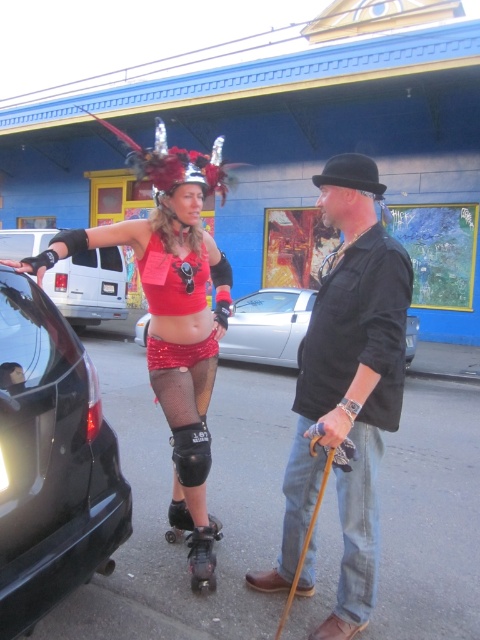
Question: Which object is positioned farthest from the black glossy car at left?

Choices:
 (A) shiny metallic shorts at center
 (B) black matte bowler hat at center
 (C) black matte car at left

Answer: (C)

Question: Is black glossy car at left smaller than black matte roller skate at lower center?

Choices:
 (A) yes
 (B) no

Answer: (B)

Question: Does black matte knee pad at center have a smaller size compared to black matte roller skate at lower center?

Choices:
 (A) yes
 (B) no

Answer: (A)

Question: Which of these objects is positioned closest to the black matte car at left?

Choices:
 (A) shiny red skirt at center
 (B) black matte roller skate at lower center
 (C) black matte bowler hat at center
 (D) black glossy car at left

Answer: (B)

Question: Can you confirm if black matte bowler hat at center is wider than shiny silver car at center?

Choices:
 (A) no
 (B) yes

Answer: (A)

Question: Estimate the real-world distances between objects in this image. Which object is closer to the shiny metallic shorts at center?

Choices:
 (A) black matte car at left
 (B) black matte roller skate at lower center
 (C) shiny red skirt at center
 (D) black matte knee pad at center

Answer: (C)